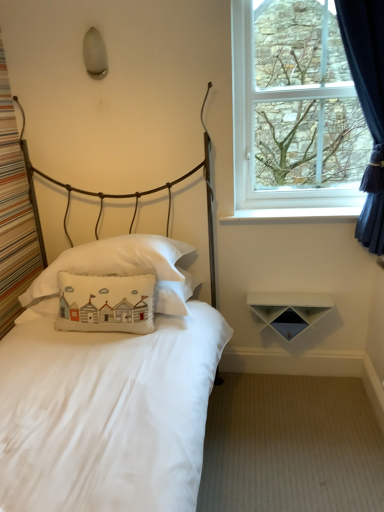
Question: Does white matte shelf at lower right appear on the right side of white cotton pillow at center, the second pillow when ordered from top to bottom?

Choices:
 (A) yes
 (B) no

Answer: (A)

Question: Does white matte shelf at lower right have a smaller size compared to white cotton pillow at center, the second pillow when ordered from top to bottom?

Choices:
 (A) no
 (B) yes

Answer: (B)

Question: From the image's perspective, would you say white matte shelf at lower right is positioned over white cotton pillow at center, the second pillow when ordered from top to bottom?

Choices:
 (A) no
 (B) yes

Answer: (A)

Question: Is white matte shelf at lower right wider than white cotton pillow at center, which ranks as the second pillow in bottom-to-top order?

Choices:
 (A) yes
 (B) no

Answer: (B)

Question: Can you confirm if white matte shelf at lower right is bigger than white cotton pillow at center, which ranks as the second pillow in bottom-to-top order?

Choices:
 (A) no
 (B) yes

Answer: (A)

Question: In the image, is white matte bed at left on the left side or the right side of dark blue velvet curtain at right?

Choices:
 (A) right
 (B) left

Answer: (B)

Question: From the image's perspective, is white matte bed at left positioned above or below dark blue velvet curtain at right?

Choices:
 (A) below
 (B) above

Answer: (A)

Question: Is point (203, 338) positioned closer to the camera than point (375, 187)?

Choices:
 (A) farther
 (B) closer

Answer: (B)

Question: Is white matte bed at left inside or outside of dark blue velvet curtain at right?

Choices:
 (A) outside
 (B) inside

Answer: (A)

Question: Is white matte bed at left wider or thinner than white matte shelf at lower right?

Choices:
 (A) wide
 (B) thin

Answer: (A)

Question: From the image's perspective, relative to white matte shelf at lower right, is white matte bed at left above or below?

Choices:
 (A) below
 (B) above

Answer: (B)

Question: Which is correct: white matte bed at left is inside white matte shelf at lower right, or outside of it?

Choices:
 (A) outside
 (B) inside

Answer: (A)

Question: Considering the positions of white matte bed at left and white matte shelf at lower right in the image, is white matte bed at left bigger or smaller than white matte shelf at lower right?

Choices:
 (A) small
 (B) big

Answer: (B)

Question: From the image's perspective, is white matte shelf at lower right positioned above or below dark blue velvet curtain at right?

Choices:
 (A) below
 (B) above

Answer: (A)

Question: Is white matte shelf at lower right wider or thinner than dark blue velvet curtain at right?

Choices:
 (A) thin
 (B) wide

Answer: (A)